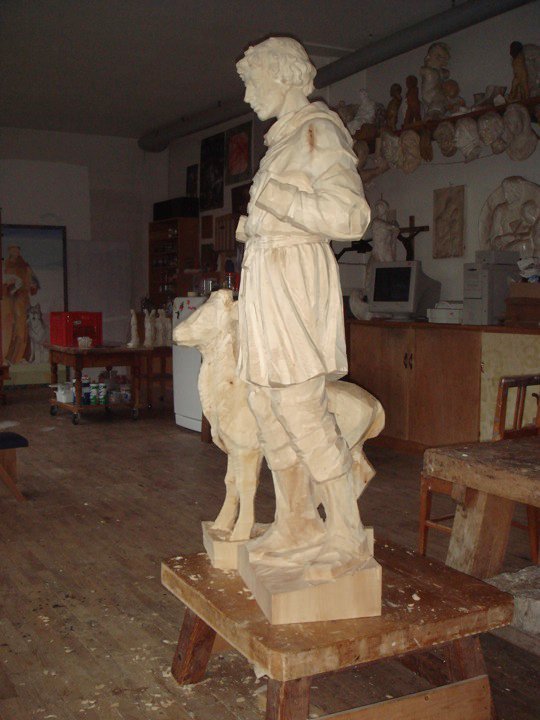
The image size is (540, 720). I want to click on wooden chair, so click(502, 382), click(436, 486).